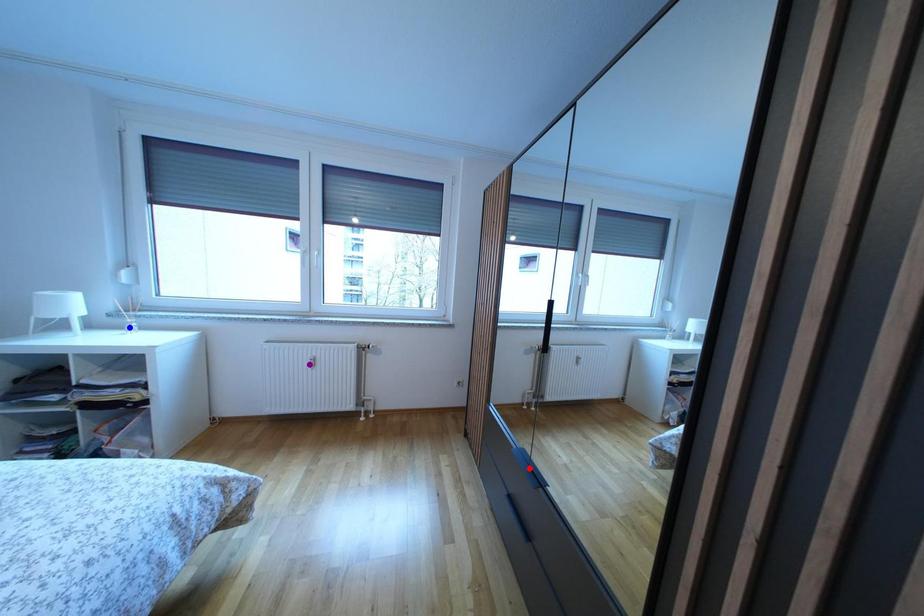
Order these from nearest to farthest:
- purple point
- blue point
- red point

red point, blue point, purple point